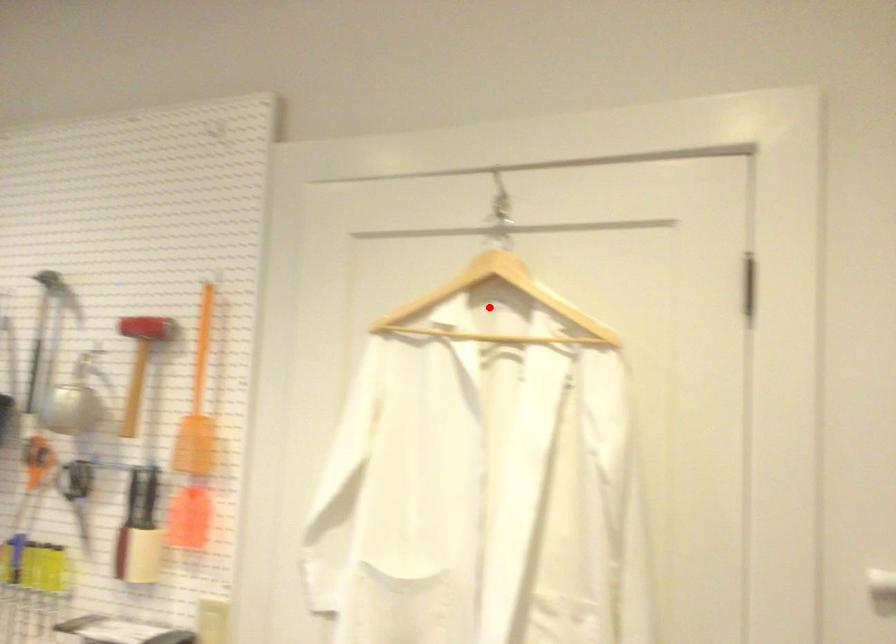
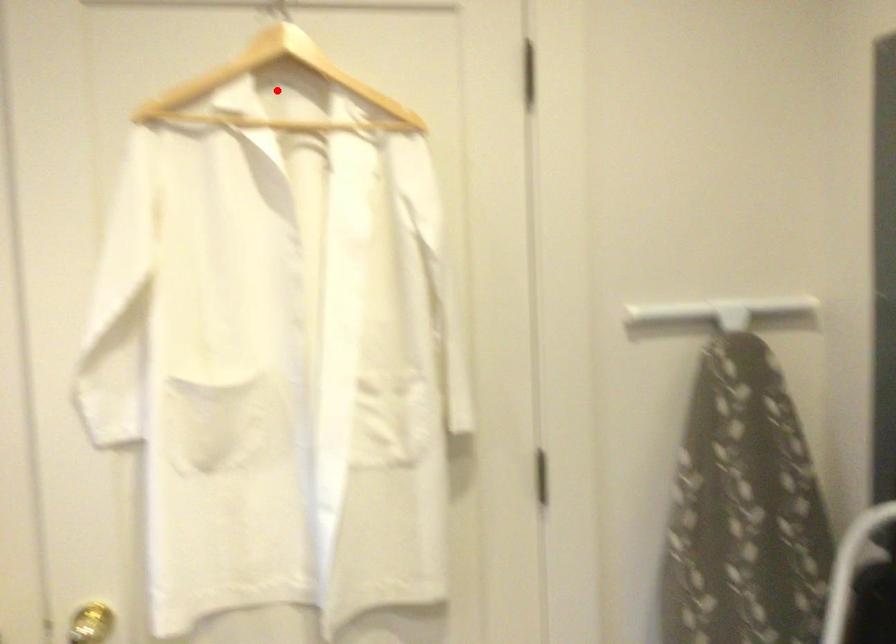
I am providing you with two images of the same scene from different viewpoints. A red point is marked on the first image and another point is marked on the second image. Are the points marked in image1 and image2 representing the same 3D position?

Yes